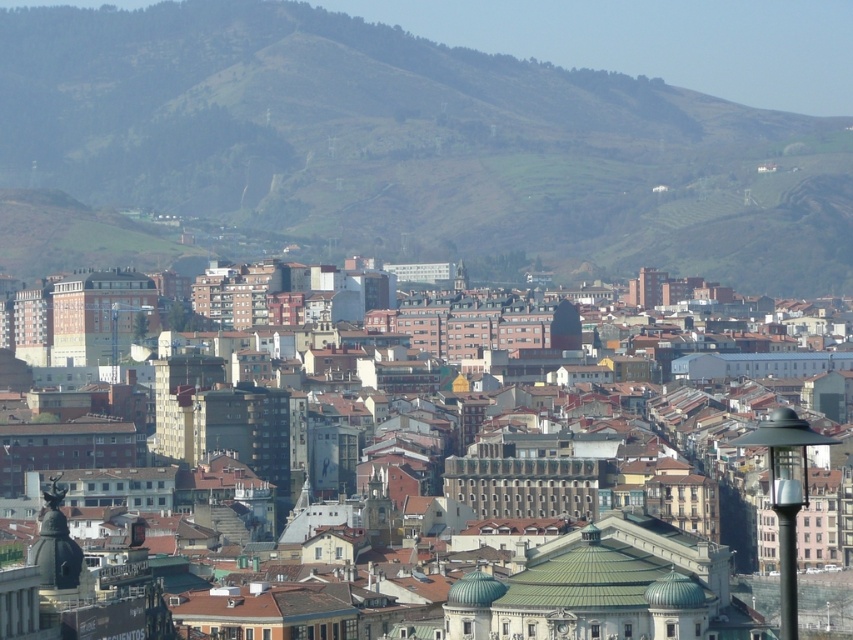
Where is `green grassy hillside at upper center`? This screenshot has height=640, width=853. green grassy hillside at upper center is located at coordinates (415, 141).

Is point (471, 122) closer to viewer compared to point (793, 438)?

No, (471, 122) is further to viewer.

The width and height of the screenshot is (853, 640). Identify the location of green grassy hillside at upper center. (415, 141).